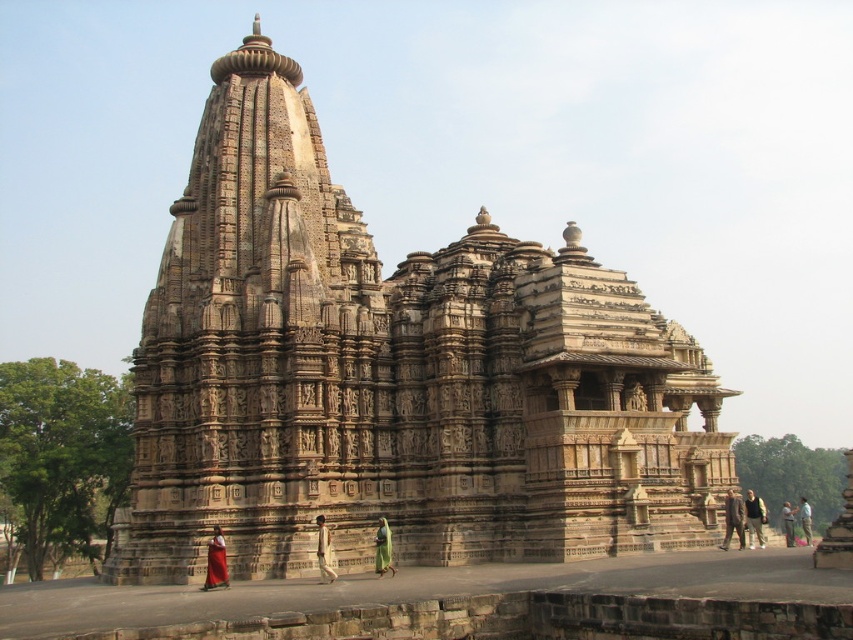
Question: Which is farther from the green fabric person at lower center?

Choices:
 (A) light brown fabric at lower right
 (B) green fabric dress at lower right
 (C) dark brown suit at center

Answer: (A)

Question: Among these points, which one is nearest to the camera?

Choices:
 (A) (386, 536)
 (B) (804, 500)

Answer: (A)

Question: Which object is farther from the camera taking this photo?

Choices:
 (A) beige stone hindu temple at center
 (B) dark brown leather jacket at lower right
 (C) green fabric person at lower center
 (D) green fabric dress at lower right

Answer: (D)

Question: Can you confirm if dark brown leather jacket at lower right is bigger than green fabric person at lower center?

Choices:
 (A) yes
 (B) no

Answer: (A)

Question: Does dark brown leather jacket at lower right come in front of green fabric dress at center?

Choices:
 (A) no
 (B) yes

Answer: (A)

Question: Can you confirm if red fabric dress at lower left is positioned above green fabric dress at lower right?

Choices:
 (A) no
 (B) yes

Answer: (B)